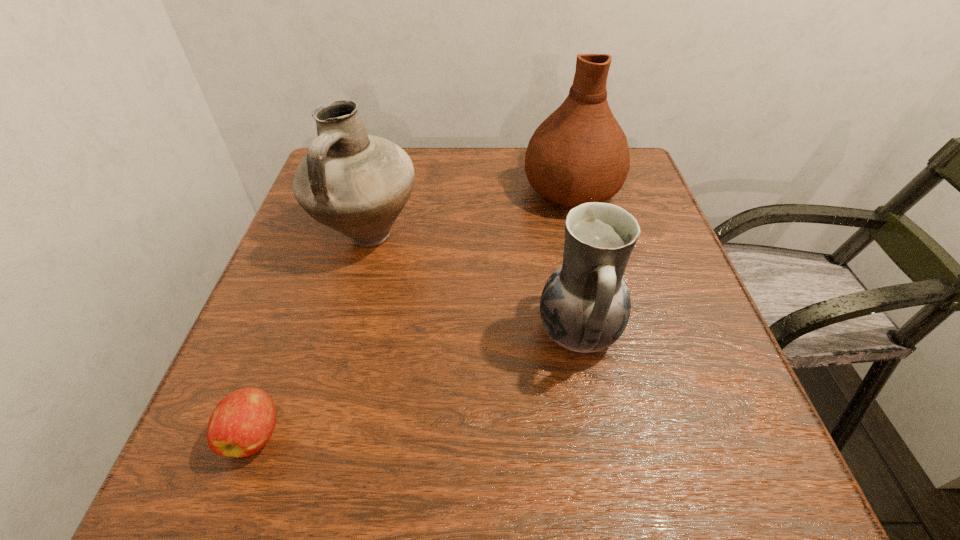
Select which pitcher is the second closest to the nearest pitcher. Please provide its 2D coordinates. Your answer should be formatted as a tuple, i.e. [(x, y)], where the tuple contains the x and y coordinates of a point satisfying the conditions above.

[(357, 184)]

Locate an element on the screen. pitcher that is the second closest to the third farthest object is located at coordinates (357, 184).